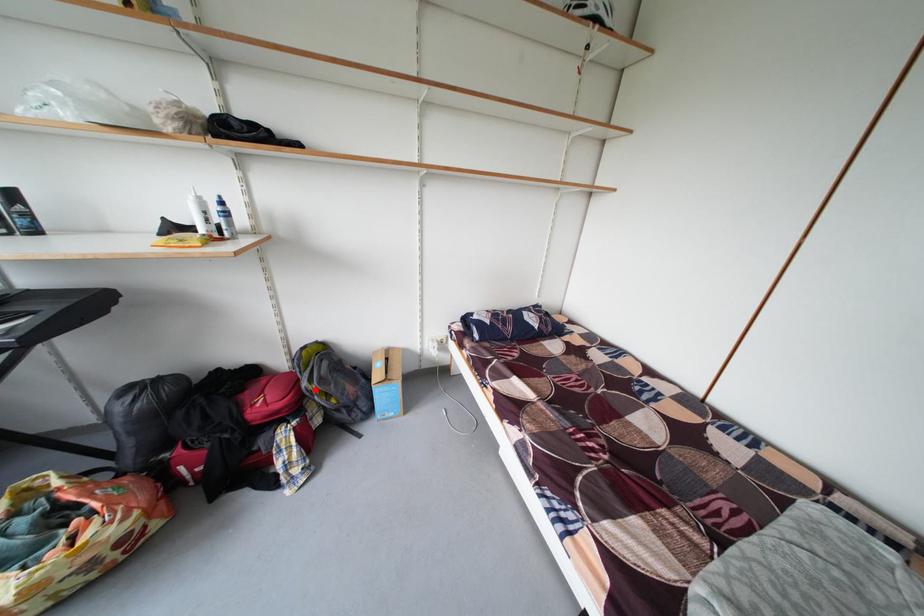
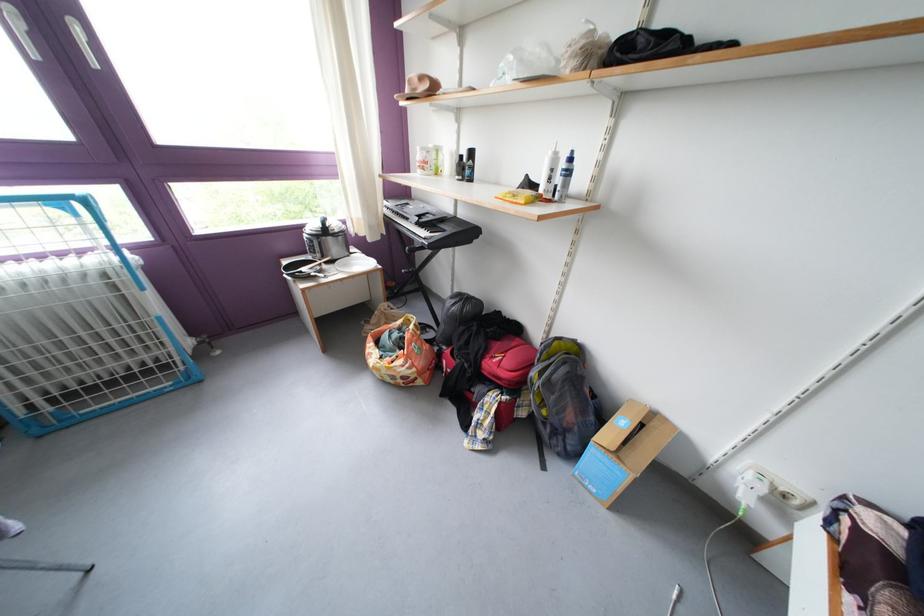
Question: I am providing you with two images of the same scene from different viewpoints. Image1 has a red point marked. In image2, the corresponding 3D location appears at what relative position? Reply with the corresponding letter.

Choices:
 (A) Closer
 (B) Farther

Answer: (B)